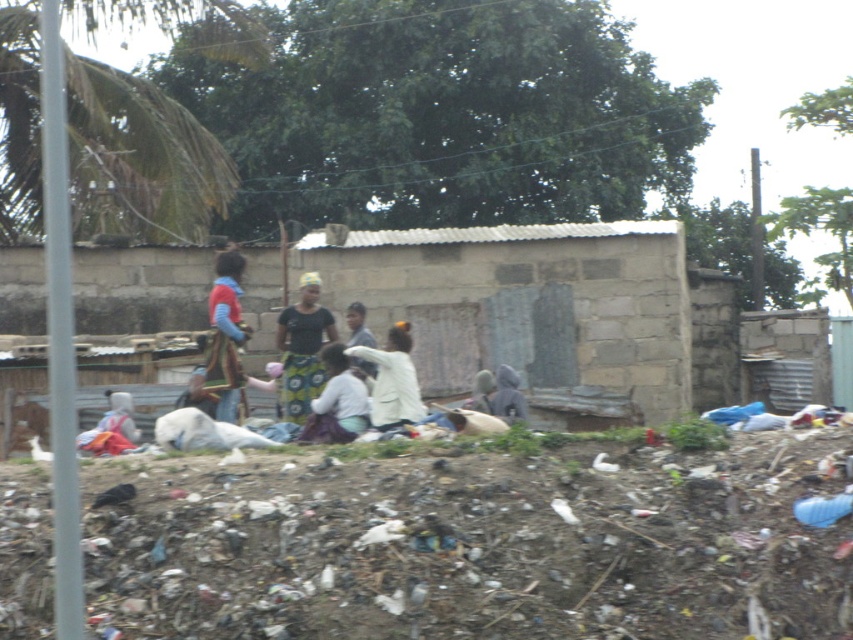
Question: Which object is closer to the camera taking this photo?

Choices:
 (A) black printed dress at center
 (B) white matte jacket at center
 (C) multicolored fabric at center
 (D) gray matte jacket at center

Answer: (B)

Question: From the image, what is the correct spatial relationship of white matte jacket at center in relation to light brown fabric at center?

Choices:
 (A) above
 (B) below

Answer: (A)

Question: Is multicolored fabric at center above light brown fabric at center?

Choices:
 (A) no
 (B) yes

Answer: (B)

Question: Based on their relative distances, which object is farther from the gray matte jacket at center?

Choices:
 (A) white matte jacket at center
 (B) multicolored fabric at center
 (C) light brown fabric bag at center
 (D) light brown fabric at center

Answer: (B)

Question: Which of the following is the closest to the observer?

Choices:
 (A) gray matte jacket at center
 (B) black printed dress at center

Answer: (A)

Question: Is gray matte jacket at center above light brown fabric at center?

Choices:
 (A) no
 (B) yes

Answer: (A)